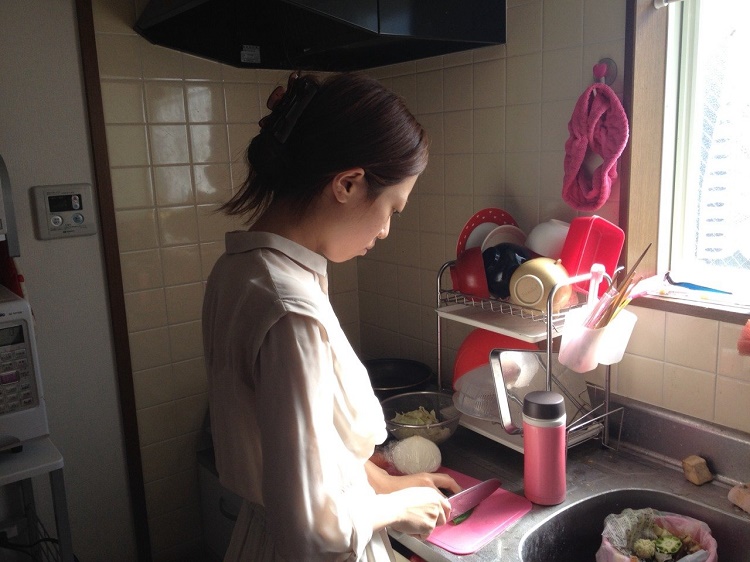
I want to click on tile wall, so click(511, 117), click(158, 163), click(711, 380).